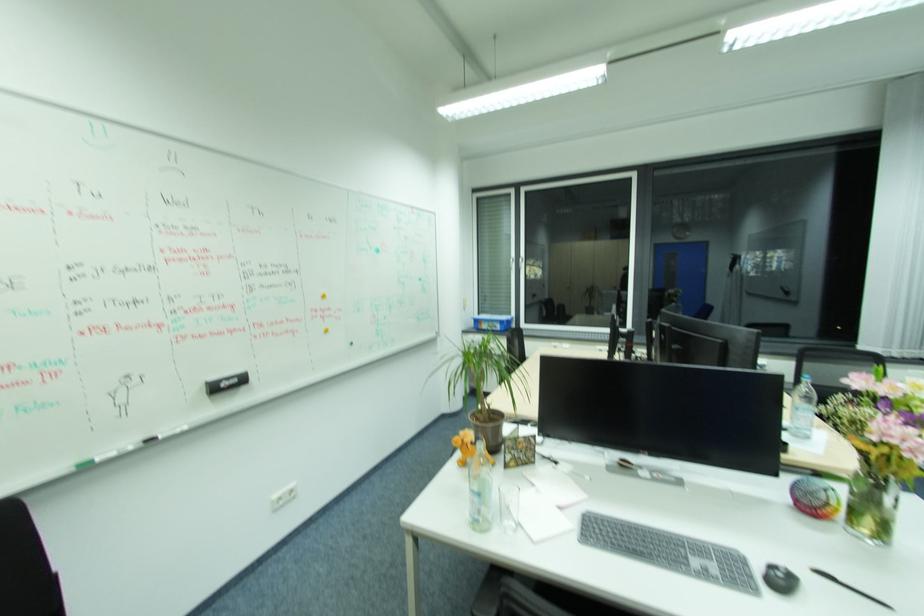
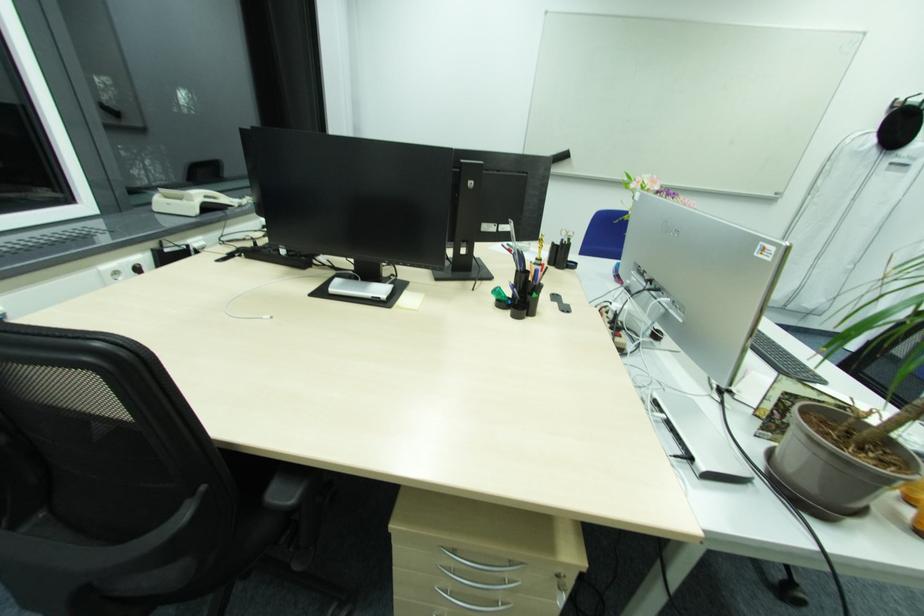
In the second image, find the point that corresponds to [606,350] in the first image.

(120, 272)